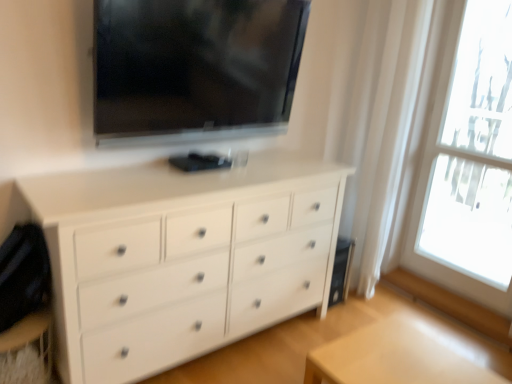
Question: Is transparent glass window at right thinner than light wood table at lower right?

Choices:
 (A) no
 (B) yes

Answer: (B)

Question: From a real-world perspective, is transparent glass window at right physically above light wood table at lower right?

Choices:
 (A) no
 (B) yes

Answer: (B)

Question: Is transparent glass window at right positioned beyond the bounds of light wood table at lower right?

Choices:
 (A) no
 (B) yes

Answer: (B)

Question: Does transparent glass window at right come in front of light wood table at lower right?

Choices:
 (A) yes
 (B) no

Answer: (B)

Question: Would you consider transparent glass window at right to be distant from light wood table at lower right?

Choices:
 (A) no
 (B) yes

Answer: (B)

Question: Is transparent glass window at right aimed at light wood table at lower right?

Choices:
 (A) yes
 (B) no

Answer: (A)

Question: Can you confirm if black glossy tv at upper center is taller than transparent glass window at right?

Choices:
 (A) no
 (B) yes

Answer: (A)

Question: From a real-world perspective, does black glossy tv at upper center sit lower than transparent glass window at right?

Choices:
 (A) yes
 (B) no

Answer: (B)

Question: Is black glossy tv at upper center wider than transparent glass window at right?

Choices:
 (A) yes
 (B) no

Answer: (A)

Question: Is transparent glass window at right completely or partially inside black glossy tv at upper center?

Choices:
 (A) yes
 (B) no

Answer: (B)

Question: Does black glossy tv at upper center turn towards transparent glass window at right?

Choices:
 (A) yes
 (B) no

Answer: (B)

Question: Is black glossy tv at upper center beside transparent glass window at right?

Choices:
 (A) yes
 (B) no

Answer: (B)

Question: From the image's perspective, is transparent glass window at right on top of white matte chest of drawers at center?

Choices:
 (A) yes
 (B) no

Answer: (A)